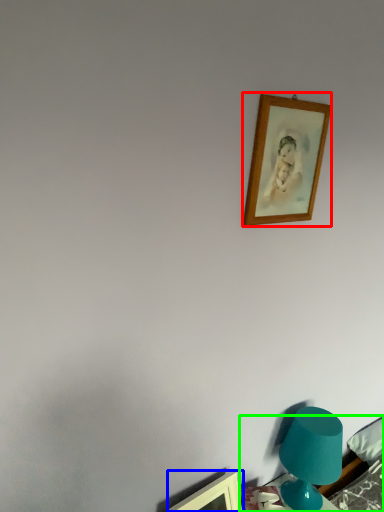
Question: Which object is the farthest from picture frame (highlighted by a red box)? Choose among these: picture frame (highlighted by a blue box) or furniture (highlighted by a green box).

Choices:
 (A) picture frame
 (B) furniture

Answer: (A)